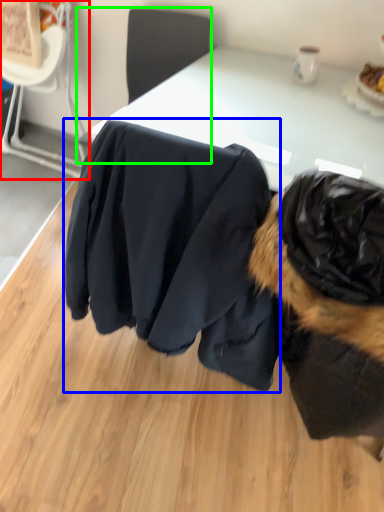
Question: Which object is positioned farthest from chair (highlighted by a red box)? Select from clothing (highlighted by a blue box) and chair (highlighted by a green box).

Choices:
 (A) clothing
 (B) chair

Answer: (A)